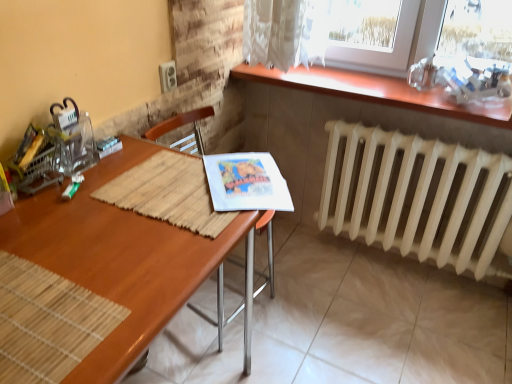
Find the location of `vacant area situated below wooden chair at center (from a real-world perspective)`. vacant area situated below wooden chair at center (from a real-world perspective) is located at coordinates (224, 313).